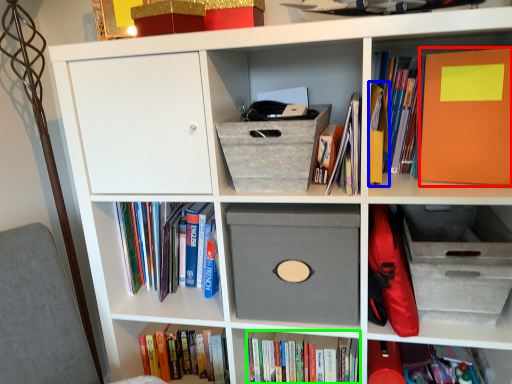
Question: Which object is positioned farthest from paperback book (highlighted by a red box)? Select from paperback book (highlighted by a blue box) and book (highlighted by a green box).

Choices:
 (A) paperback book
 (B) book

Answer: (B)